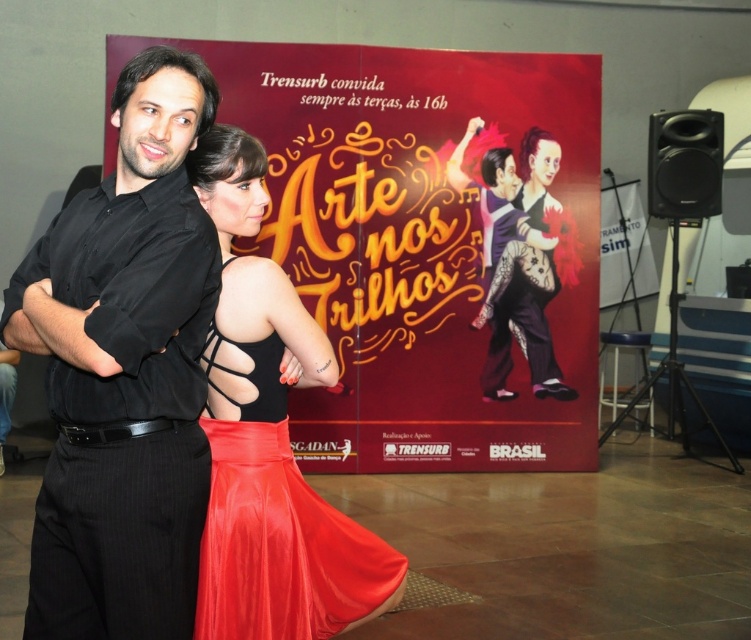
Where is the black pinstripe pants at left located in the image?

The black pinstripe pants at left is located at point (124, 371) in the image.

You are a photographer setting up for a group photo. You need to ensure that the black pinstripe pants at left and the satin red dress at center are both in focus. The camera you are using has a depth of field that can cover 16 inches. Will both objects be in focus?

The distance between the black pinstripe pants at left and the satin red dress at center is 16.53 inches. Since the camera can only cover 16 inches, the objects are slightly out of the depth of field range, so they might not both be in focus.